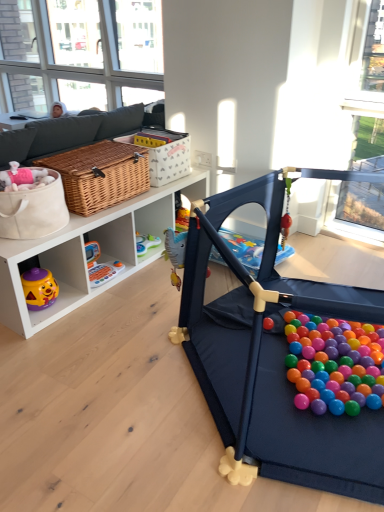
Question: From the image's perspective, is woven brown basket at upper center on top of clear glass window at upper left?

Choices:
 (A) yes
 (B) no

Answer: (B)

Question: Considering the relative positions of woven brown basket at upper center and clear glass window at upper left in the image provided, is woven brown basket at upper center to the right of clear glass window at upper left from the viewer's perspective?

Choices:
 (A) no
 (B) yes

Answer: (B)

Question: Considering the relative sizes of woven brown basket at upper center and clear glass window at upper left in the image provided, is woven brown basket at upper center bigger than clear glass window at upper left?

Choices:
 (A) no
 (B) yes

Answer: (A)

Question: From the image's perspective, is woven brown basket at upper center below clear glass window at upper left?

Choices:
 (A) no
 (B) yes

Answer: (B)

Question: Is clear glass window at upper left inside woven brown basket at upper center?

Choices:
 (A) yes
 (B) no

Answer: (B)

Question: Are woven brown basket at upper center and clear glass window at upper left located far from each other?

Choices:
 (A) no
 (B) yes

Answer: (B)

Question: Is matte wicker basket at center-left, arranged as the 1th toy when viewed from the top, taller than rubberized plastic toy at lower left, marked as the 1th toy in a left-to-right arrangement?

Choices:
 (A) yes
 (B) no

Answer: (A)

Question: From the image's perspective, is matte wicker basket at center-left, which ranks as the 2th toy in back-to-front order, beneath rubberized plastic toy at lower left, the first toy from the bottom?

Choices:
 (A) yes
 (B) no

Answer: (B)

Question: From a real-world perspective, is matte wicker basket at center-left, arranged as the 1th toy when viewed from the top, under rubberized plastic toy at lower left, marked as the 1th toy in a left-to-right arrangement?

Choices:
 (A) yes
 (B) no

Answer: (B)

Question: Is matte wicker basket at center-left, which is the 1th toy from front to back, placed right next to rubberized plastic toy at lower left, the 2th toy from the top?

Choices:
 (A) yes
 (B) no

Answer: (B)

Question: Is matte wicker basket at center-left, which is the 1th toy from front to back, wider than rubberized plastic toy at lower left, the first toy from the bottom?

Choices:
 (A) no
 (B) yes

Answer: (B)

Question: Are matte wicker basket at center-left, the second toy from the left, and rubberized plastic toy at lower left, the first toy from the bottom, located far from each other?

Choices:
 (A) yes
 (B) no

Answer: (B)

Question: From the image's perspective, does woven brown picnic basket at center-left appear higher than woven brown basket at upper center?

Choices:
 (A) no
 (B) yes

Answer: (A)